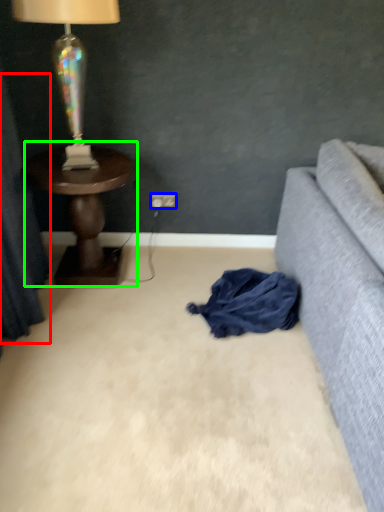
Question: Which object is positioned farthest from curtain (highlighted by a red box)? Select from power outlet (highlighted by a blue box) and table (highlighted by a green box).

Choices:
 (A) power outlet
 (B) table

Answer: (A)